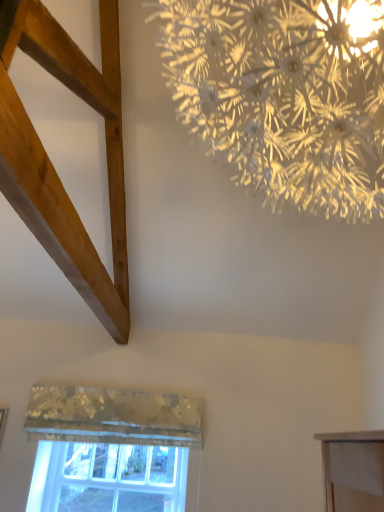
Question: From a real-world perspective, is iridescent metallic chandelier at upper center under metallic textured curtain at lower center?

Choices:
 (A) no
 (B) yes

Answer: (A)

Question: Can you confirm if iridescent metallic chandelier at upper center is wider than metallic textured curtain at lower center?

Choices:
 (A) no
 (B) yes

Answer: (B)

Question: Is iridescent metallic chandelier at upper center positioned behind metallic textured curtain at lower center?

Choices:
 (A) yes
 (B) no

Answer: (B)

Question: Are iridescent metallic chandelier at upper center and metallic textured curtain at lower center far apart?

Choices:
 (A) no
 (B) yes

Answer: (B)

Question: Does iridescent metallic chandelier at upper center come in front of metallic textured curtain at lower center?

Choices:
 (A) no
 (B) yes

Answer: (B)

Question: Is iridescent metallic chandelier at upper center facing towards metallic textured curtain at lower center?

Choices:
 (A) no
 (B) yes

Answer: (B)

Question: Does metallic textured curtain at lower center appear on the right side of clear glass window at lower left?

Choices:
 (A) no
 (B) yes

Answer: (B)

Question: From a real-world perspective, is metallic textured curtain at lower center over clear glass window at lower left?

Choices:
 (A) no
 (B) yes

Answer: (B)

Question: Considering the relative positions of metallic textured curtain at lower center and clear glass window at lower left in the image provided, is metallic textured curtain at lower center in front of clear glass window at lower left?

Choices:
 (A) no
 (B) yes

Answer: (B)

Question: Can you confirm if metallic textured curtain at lower center is taller than clear glass window at lower left?

Choices:
 (A) no
 (B) yes

Answer: (A)

Question: Does metallic textured curtain at lower center have a smaller size compared to clear glass window at lower left?

Choices:
 (A) yes
 (B) no

Answer: (B)

Question: Does metallic textured curtain at lower center appear on the left side of clear glass window at lower left?

Choices:
 (A) no
 (B) yes

Answer: (A)

Question: Could you tell me if natural wood plank at upper left is facing metallic textured curtain at lower center?

Choices:
 (A) no
 (B) yes

Answer: (A)